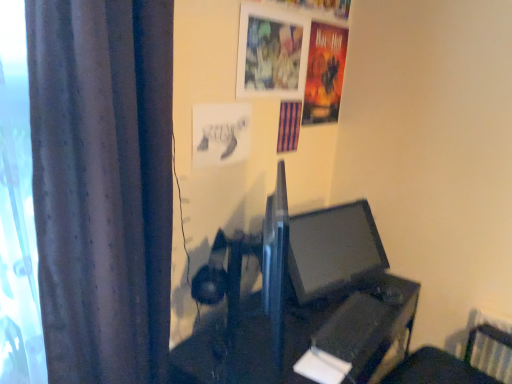
What do you see at coordinates (324, 73) in the screenshot?
I see `matt paper poster at upper right, which is counted as the third poster page, starting from the left` at bounding box center [324, 73].

Find the location of `dark grey fabric curtain at left`. dark grey fabric curtain at left is located at coordinates (103, 185).

Identify the location of metallic silver picture frame at upper center. (271, 53).

Describe the element at coordinates (271, 53) in the screenshot. I see `metallic silver picture frame at upper center` at that location.

Locate an element on the screen. The width and height of the screenshot is (512, 384). white paper at upper center, acting as the 3th poster page starting from the right is located at coordinates (220, 134).

Measure the distance between matte black monitor at center and camera.

matte black monitor at center and camera are 4.06 feet apart.

Locate an element on the screen. The image size is (512, 384). matt paper poster at upper right, which is counted as the first poster page, starting from the right is located at coordinates (324, 73).

From the image's perspective, is matt paper poster at upper right, which is counted as the first poster page, starting from the right, located above or below black plastic table at center?

matt paper poster at upper right, which is counted as the first poster page, starting from the right, is situated higher than black plastic table at center in the image.

Can you confirm if matt paper poster at upper right, which is counted as the third poster page, starting from the left, is positioned to the right of black plastic table at center?

Yes, matt paper poster at upper right, which is counted as the third poster page, starting from the left, is to the right of black plastic table at center.

Does point (327, 51) come closer to viewer compared to point (326, 342)?

No, (327, 51) is further to viewer.

In terms of width, does matt paper poster at upper right, the first poster page in the back-to-front sequence, look wider or thinner when compared to black plastic table at center?

matt paper poster at upper right, the first poster page in the back-to-front sequence, is thinner than black plastic table at center.

Is the position of metallic silver picture frame at upper center more distant than that of black plastic table at center?

Yes, the depth of metallic silver picture frame at upper center is greater than that of black plastic table at center.

Which point is more distant from viewer, (284,44) or (234,356)?

The point (284,44) is farther from the camera.

Could you tell me if metallic silver picture frame at upper center is facing black plastic table at center?

No.

Can you confirm if metallic silver picture frame at upper center is smaller than black plastic table at center?

Indeed, metallic silver picture frame at upper center has a smaller size compared to black plastic table at center.

Are matte black monitor at center and white paper at upper center, which ranks as the 1th poster page in left-to-right order, far apart?

No.

Between matte black monitor at center and white paper at upper center, placed as the 3th poster page when sorted from back to front, which one has less height?

With less height is white paper at upper center, placed as the 3th poster page when sorted from back to front.

In terms of size, does matte black monitor at center appear bigger or smaller than white paper at upper center, which ranks as the 1th poster page in left-to-right order?

In the image, matte black monitor at center appears to be larger than white paper at upper center, which ranks as the 1th poster page in left-to-right order.

From the picture: Which object is positioned more to the left, matte black monitor at center or white paper at upper center, acting as the 3th poster page starting from the right?

Positioned to the left is white paper at upper center, acting as the 3th poster page starting from the right.

Considering the relative sizes of matte black monitor at center and dark grey fabric curtain at left in the image provided, is matte black monitor at center bigger than dark grey fabric curtain at left?

Actually, matte black monitor at center might be smaller than dark grey fabric curtain at left.

Looking at this image, is matte black monitor at center directly adjacent to dark grey fabric curtain at left?

No, matte black monitor at center is not touching dark grey fabric curtain at left.

Choose the correct answer: Is matte black monitor at center inside dark grey fabric curtain at left or outside it?

matte black monitor at center exists outside the volume of dark grey fabric curtain at left.

Which of these two, matte black monitor at center or dark grey fabric curtain at left, is thinner?

With smaller width is matte black monitor at center.

What's the angular difference between matte black monitor at center and black plastic table at center's facing directions?

The facing directions of matte black monitor at center and black plastic table at center are 14 degrees apart.

Where is `table below the matte black monitor at center (from the image's perspective)`? table below the matte black monitor at center (from the image's perspective) is located at coordinates (352, 327).

Is matte black monitor at center taller than black plastic table at center?

No, matte black monitor at center is not taller than black plastic table at center.

From the image's perspective, would you say matte black monitor at center is shown under matt paper poster at upper right, the first poster page in the back-to-front sequence?

Indeed, from the image's perspective, matte black monitor at center is shown beneath matt paper poster at upper right, the first poster page in the back-to-front sequence.

Does matte black monitor at center turn towards matt paper poster at upper right, the first poster page in the back-to-front sequence?

No, matte black monitor at center is not turned towards matt paper poster at upper right, the first poster page in the back-to-front sequence.

Are matte black monitor at center and matt paper poster at upper right, which is counted as the first poster page, starting from the right, far apart?

No, matte black monitor at center is in close proximity to matt paper poster at upper right, which is counted as the first poster page, starting from the right.

Looking at this image, from a real-world perspective, is matte black monitor at center physically below matt paper poster at upper right, the first poster page in the back-to-front sequence?

Yes.

Considering the points (328, 332) and (244, 58), which point is in front, point (328, 332) or point (244, 58)?

The point (328, 332) is closer.

How different are the orientations of black plastic table at center and metallic silver picture frame at upper center in degrees?

They differ by 2.93 degrees in their facing directions.

Considering the sizes of objects black plastic table at center and metallic silver picture frame at upper center in the image provided, who is smaller, black plastic table at center or metallic silver picture frame at upper center?

Smaller between the two is metallic silver picture frame at upper center.

Can you confirm if black plastic table at center is thinner than metallic silver picture frame at upper center?

In fact, black plastic table at center might be wider than metallic silver picture frame at upper center.

Locate an element on the screen. the 3rd poster page above when counting from the black plastic table at center (from the image's perspective) is located at coordinates tap(324, 73).

Locate an element on the screen. table that is under the metallic silver picture frame at upper center (from a real-world perspective) is located at coordinates (352, 327).

When comparing their distances from matt paper poster at upper right, which is counted as the third poster page, starting from the left, does metallic silver picture frame at upper center or dark grey fabric curtain at left seem further?

dark grey fabric curtain at left is positioned further to the anchor matt paper poster at upper right, which is counted as the third poster page, starting from the left.

Based on their spatial positions, is dark grey fabric curtain at left or purple striped poster at upper center, marked as the second poster page in a front-to-back arrangement, closer to matt paper poster at upper right, arranged as the 3th poster page when viewed from the front?

purple striped poster at upper center, marked as the second poster page in a front-to-back arrangement, is closer to matt paper poster at upper right, arranged as the 3th poster page when viewed from the front.

When comparing their distances from white paper at upper center, the first poster page positioned from the front, does matt paper poster at upper right, the first poster page in the back-to-front sequence, or purple striped poster at upper center, the 2th poster page viewed from the left, seem further?

matt paper poster at upper right, the first poster page in the back-to-front sequence, is further to white paper at upper center, the first poster page positioned from the front.

From the image, which object appears to be nearer to dark grey fabric curtain at left, white paper at upper center, the first poster page positioned from the front, or matt paper poster at upper right, which is counted as the first poster page, starting from the right?

Among the two, white paper at upper center, the first poster page positioned from the front, is located nearer to dark grey fabric curtain at left.

Consider the image. From the image, which object appears to be farther from purple striped poster at upper center, the 2th poster page viewed from the left, white paper at upper center, acting as the 3th poster page starting from the right, or black plastic table at center?

Among the two, black plastic table at center is located further to purple striped poster at upper center, the 2th poster page viewed from the left.

Consider the image. Estimate the real-world distances between objects in this image. Which object is further from white paper at upper center, acting as the 3th poster page starting from the right, matte black monitor at center or dark grey fabric curtain at left?

Based on the image, matte black monitor at center appears to be further to white paper at upper center, acting as the 3th poster page starting from the right.

From the image, which object appears to be farther from matte black monitor at center, purple striped poster at upper center, placed as the 2th poster page when sorted from right to left, or matt paper poster at upper right, the first poster page in the back-to-front sequence?

Among the two, matt paper poster at upper right, the first poster page in the back-to-front sequence, is located further to matte black monitor at center.

Estimate the real-world distances between objects in this image. Which object is closer to black plastic table at center, white paper at upper center, acting as the 3th poster page starting from the right, or dark grey fabric curtain at left?

dark grey fabric curtain at left lies closer to black plastic table at center than the other object.

Identify the location of computer between white paper at upper center, the first poster page positioned from the front, and black plastic table at center vertically. (348, 293).

Where is `computer between dark grey fabric curtain at left and purple striped poster at upper center, marked as the second poster page in a front-to-back arrangement, along the z-axis`? computer between dark grey fabric curtain at left and purple striped poster at upper center, marked as the second poster page in a front-to-back arrangement, along the z-axis is located at coordinates (348, 293).

Identify the location of picture frame between dark grey fabric curtain at left and matt paper poster at upper right, arranged as the 3th poster page when viewed from the front, from front to back. (271, 53).

Find the location of `poster page between metallic silver picture frame at upper center and matt paper poster at upper right, which is counted as the first poster page, starting from the right, from front to back`. poster page between metallic silver picture frame at upper center and matt paper poster at upper right, which is counted as the first poster page, starting from the right, from front to back is located at coordinates (289, 126).